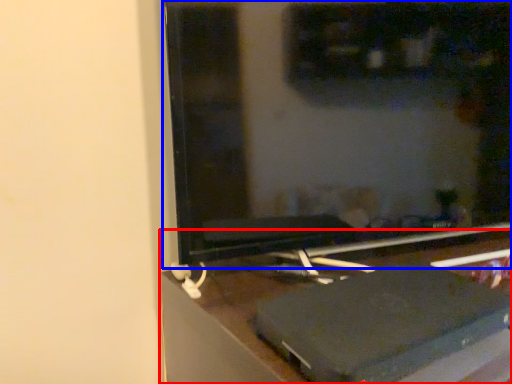
Question: Which point is closer to the camera, furniture (highlighted by a red box) or computer monitor (highlighted by a blue box)?

Choices:
 (A) furniture
 (B) computer monitor

Answer: (A)